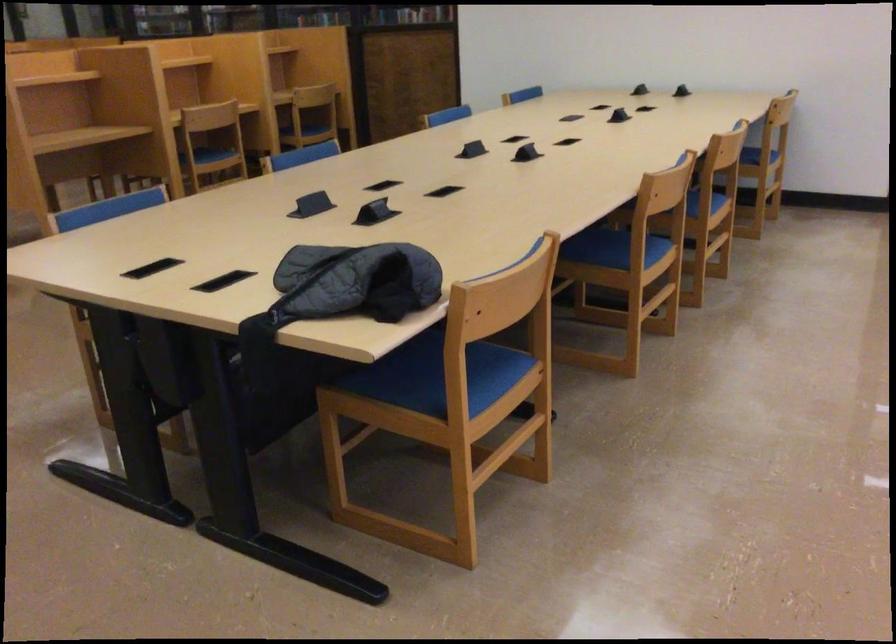
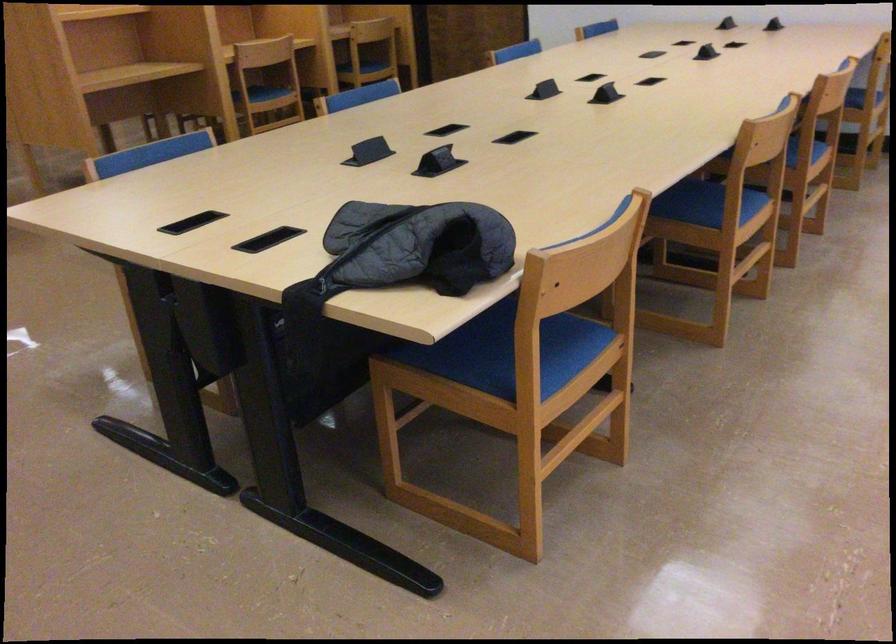
Where in the second image is the point corresponding to (700,222) from the first image?

(805, 171)